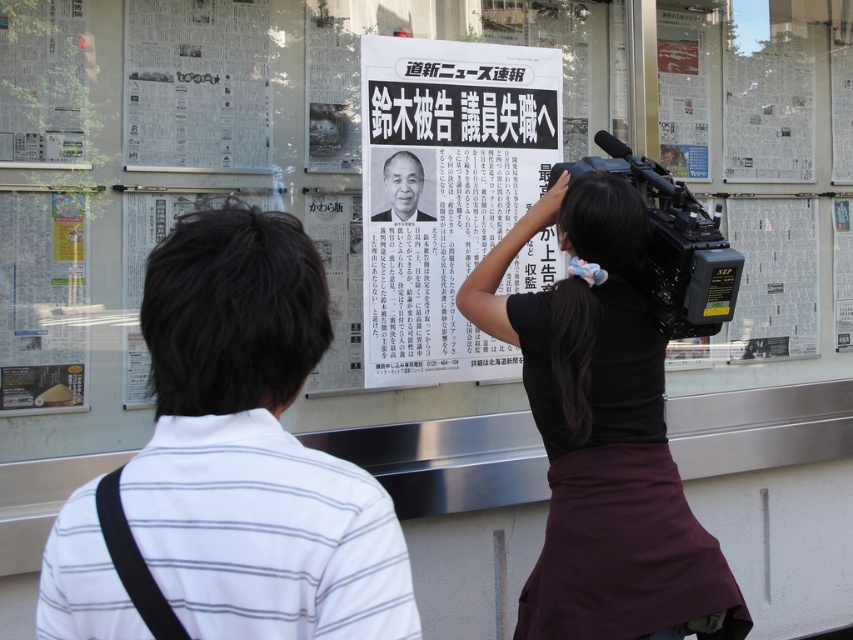
Question: Which point appears farthest from the camera in this image?

Choices:
 (A) (619, 484)
 (B) (635, 186)

Answer: (B)

Question: Can you confirm if black paper at center is thinner than smooth black portrait at center?

Choices:
 (A) yes
 (B) no

Answer: (B)

Question: Considering the relative positions of black plastic video camera at center and smooth black portrait at center in the image provided, where is black plastic video camera at center located with respect to smooth black portrait at center?

Choices:
 (A) left
 (B) right

Answer: (B)

Question: Which point appears closest to the camera in this image?

Choices:
 (A) (447, 61)
 (B) (395, 193)
 (C) (660, 172)
 (D) (195, 8)

Answer: (C)

Question: Which object is farther from the camera taking this photo?

Choices:
 (A) black fabric camera at center
 (B) yellow paper poster at lower left
 (C) white paper poster at upper left
 (D) white striped shirt at center

Answer: (C)

Question: Is white striped shirt at center to the left of black fabric camera at center from the viewer's perspective?

Choices:
 (A) no
 (B) yes

Answer: (B)